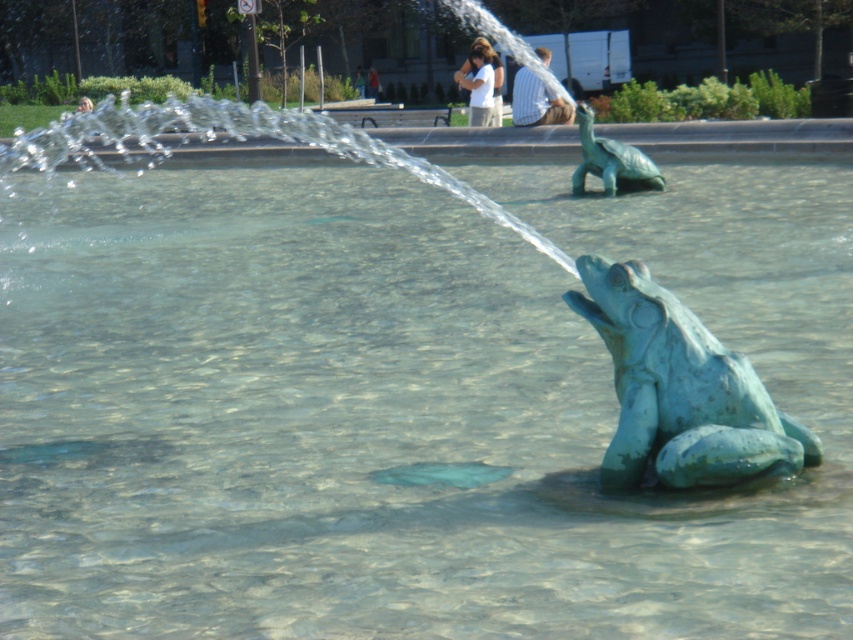
Question: Among these points, which one is farthest from the camera?

Choices:
 (A) (636, 177)
 (B) (730, 387)

Answer: (A)

Question: Is green patina frog at center wider than green patina turtle at upper center?

Choices:
 (A) no
 (B) yes

Answer: (B)

Question: Is green patina frog at center below green patina turtle at upper center?

Choices:
 (A) yes
 (B) no

Answer: (A)

Question: In this image, where is green patina frog at center located relative to green patina turtle at upper center?

Choices:
 (A) left
 (B) right

Answer: (A)

Question: Which point is farther to the camera?

Choices:
 (A) green patina frog at center
 (B) green patina turtle at upper center

Answer: (B)